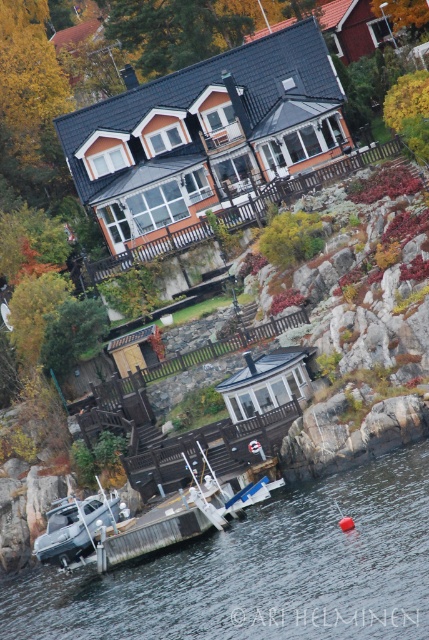
Question: Does clear water at lower center have a larger size compared to white plastic boat at lower center?

Choices:
 (A) yes
 (B) no

Answer: (A)

Question: Is clear water at lower center above white plastic boat at lower center?

Choices:
 (A) no
 (B) yes

Answer: (B)

Question: Does clear water at lower center appear on the right side of white plastic boat at lower center?

Choices:
 (A) no
 (B) yes

Answer: (B)

Question: Which point appears farthest from the camera in this image?

Choices:
 (A) (72, 588)
 (B) (103, 500)

Answer: (B)